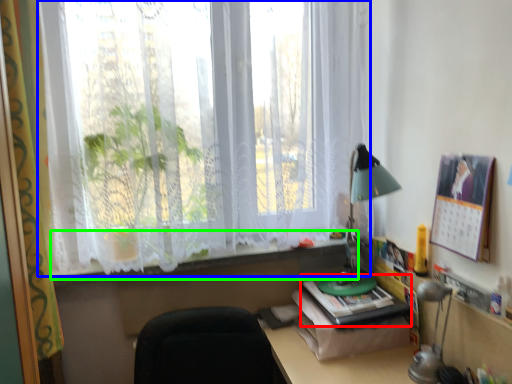
Question: Which object is positioned closest to paperback book (highlighted by a red box)? Select from window (highlighted by a blue box) and window sill (highlighted by a green box).

Choices:
 (A) window
 (B) window sill

Answer: (B)